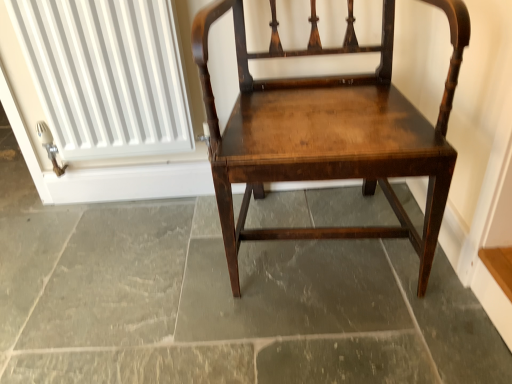
Image resolution: width=512 pixels, height=384 pixels. In order to click on white ribbed radiator at upper left in this screenshot , I will do `click(106, 75)`.

From the image's perspective, which one is positioned lower, shiny dark wood chair at center or white ribbed radiator at upper left?

shiny dark wood chair at center.

Is shiny dark wood chair at center facing away from white ribbed radiator at upper left?

No, shiny dark wood chair at center's orientation is not away from white ribbed radiator at upper left.

Based on the photo, from a real-world perspective, relative to white ribbed radiator at upper left, is shiny dark wood chair at center vertically above or below?

Clearly, from a real-world perspective, shiny dark wood chair at center is below white ribbed radiator at upper left.

Between shiny dark wood chair at center and white ribbed radiator at upper left, which one is positioned behind?

white ribbed radiator at upper left is more distant.

Is dark gray stone floor at center shorter than shiny dark wood chair at center?

Yes, dark gray stone floor at center is shorter than shiny dark wood chair at center.

Find the location of `chair located above the dark gray stone floor at center (from the image's perspective)`. chair located above the dark gray stone floor at center (from the image's perspective) is located at coordinates (328, 131).

From the picture: How far apart are dark gray stone floor at center and shiny dark wood chair at center?

dark gray stone floor at center and shiny dark wood chair at center are 13.54 inches apart.

Who is smaller, dark gray stone floor at center or shiny dark wood chair at center?

dark gray stone floor at center is smaller.

Which object is wider, white ribbed radiator at upper left or dark gray stone floor at center?

With larger width is dark gray stone floor at center.

Is white ribbed radiator at upper left placed right next to dark gray stone floor at center?

white ribbed radiator at upper left and dark gray stone floor at center are not in contact.

From a real-world perspective, which object stands above the other?

From a 3D spatial view, white ribbed radiator at upper left is above.

In the image, is white ribbed radiator at upper left on the left side or the right side of dark gray stone floor at center?

In the image, white ribbed radiator at upper left appears on the left side of dark gray stone floor at center.

Locate an element on the screen. The image size is (512, 384). concrete behind the shiny dark wood chair at center is located at coordinates (226, 305).

Does shiny dark wood chair at center come behind dark gray stone floor at center?

No.

Is shiny dark wood chair at center spatially inside dark gray stone floor at center, or outside of it?

shiny dark wood chair at center is spatially situated outside dark gray stone floor at center.

Considering the sizes of shiny dark wood chair at center and dark gray stone floor at center in the image, is shiny dark wood chair at center wider or thinner than dark gray stone floor at center?

shiny dark wood chair at center is thinner than dark gray stone floor at center.

Between dark gray stone floor at center and white ribbed radiator at upper left, which one has larger size?

dark gray stone floor at center.

From a real-world perspective, between dark gray stone floor at center and white ribbed radiator at upper left, who is vertically lower?

From a 3D spatial view, dark gray stone floor at center is below.

Between dark gray stone floor at center and white ribbed radiator at upper left, which one appears on the right side from the viewer's perspective?

dark gray stone floor at center is more to the right.

In the scene shown: Which object is wider, dark gray stone floor at center or white ribbed radiator at upper left?

Wider between the two is dark gray stone floor at center.

Is point (89, 53) positioned behind point (384, 165)?

Yes.

Which of these two, white ribbed radiator at upper left or shiny dark wood chair at center, stands shorter?

white ribbed radiator at upper left is shorter.

Considering their positions, is white ribbed radiator at upper left located in front of or behind shiny dark wood chair at center?

white ribbed radiator at upper left is positioned farther from the viewer than shiny dark wood chair at center.

Is white ribbed radiator at upper left outside of shiny dark wood chair at center?

Absolutely, white ribbed radiator at upper left is external to shiny dark wood chair at center.

Find the location of a particular element. chair below the white ribbed radiator at upper left (from a real-world perspective) is located at coordinates (328, 131).

The image size is (512, 384). Identify the location of chair located on the right of dark gray stone floor at center. (328, 131).

Estimate the real-world distances between objects in this image. Which object is closer to dark gray stone floor at center, white ribbed radiator at upper left or shiny dark wood chair at center?

shiny dark wood chair at center.

Looking at this image, considering their positions, is dark gray stone floor at center positioned closer to white ribbed radiator at upper left than shiny dark wood chair at center?

shiny dark wood chair at center is closer to white ribbed radiator at upper left.

Consider the image. From the image, which object appears to be nearer to shiny dark wood chair at center, dark gray stone floor at center or white ribbed radiator at upper left?

dark gray stone floor at center.

Considering their positions, is shiny dark wood chair at center positioned further to white ribbed radiator at upper left than dark gray stone floor at center?

The object further to white ribbed radiator at upper left is dark gray stone floor at center.

Estimate the real-world distances between objects in this image. Which object is closer to shiny dark wood chair at center, white ribbed radiator at upper left or dark gray stone floor at center?

dark gray stone floor at center.

Estimate the real-world distances between objects in this image. Which object is further from dark gray stone floor at center, shiny dark wood chair at center or white ribbed radiator at upper left?

white ribbed radiator at upper left.

Where is `concrete between white ribbed radiator at upper left and shiny dark wood chair at center`? The width and height of the screenshot is (512, 384). concrete between white ribbed radiator at upper left and shiny dark wood chair at center is located at coordinates (226, 305).